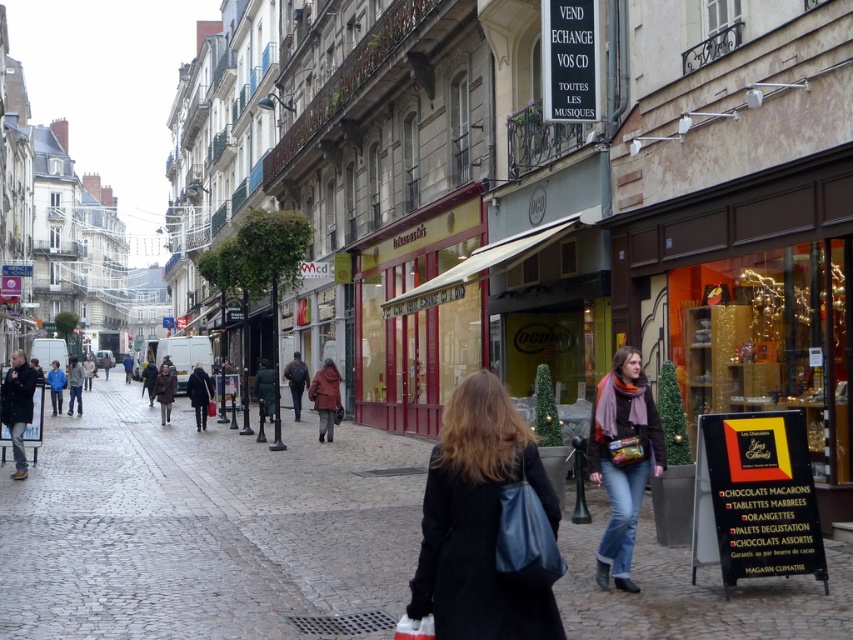
You are a delivery person trying to place a package on the ground between the cobblestone pavement at center and the denim jeans at center. Which surface should you choose to ensure the package remains stable?

The cobblestone pavement at center has a larger size compared to denim jeans at center, so placing the package on the cobblestone pavement at center will provide a more stable surface due to its larger and more solid structure.

Based on the photo, you are a delivery person carrying a heavy package and need to cross the street from the cobblestone pavement at center to the denim jeans at center. The package is 1.2 meters long. Can you carry it horizontally without tilting it? Explain your answer using the distance between them.

The cobblestone pavement at center is 7.54 meters away from the denim jeans at center. Since the package is only 1.2 meters long, the distance between them is more than sufficient to carry it horizontally without tilting.

What is the 2D coordinate of the cobblestone pavement at center?

The 2D coordinate of the cobblestone pavement at center is at point [206,528].